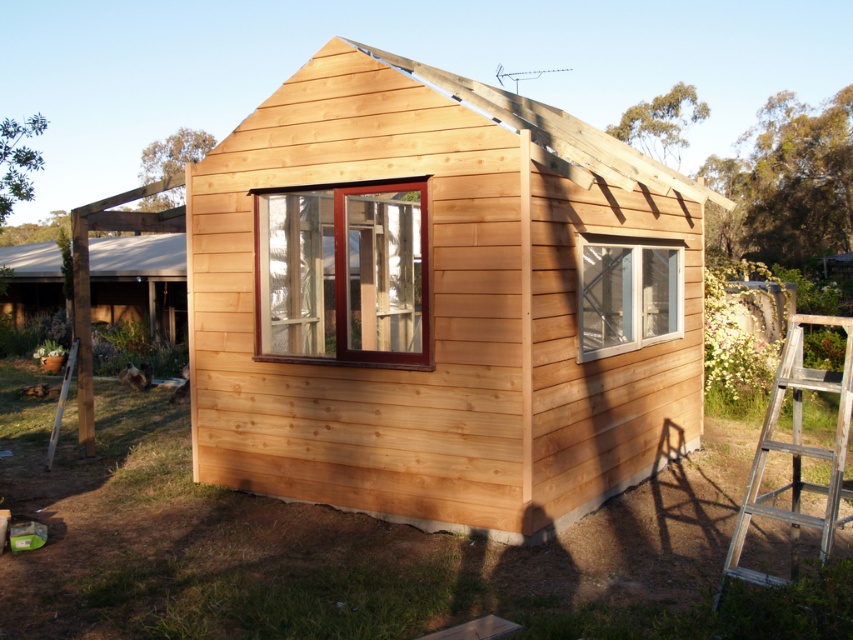
You are a contractor inspecting the wooden structure. You notice the white smooth roof at upper left and the clear glass window at center. Which object is closer to you as you stand in front of the structure?

The white smooth roof at upper left is closer to you because it is further to the viewer than the clear glass window at center, meaning it appears nearer in perspective.

You are an architect inspecting the construction site. You notice the white smooth roof at upper left and the clear glass window at center. Which of these two elements has a bigger surface area?

The white smooth roof at upper left has a larger size compared to the clear glass window at center, so the white smooth roof at upper left has a bigger surface area.